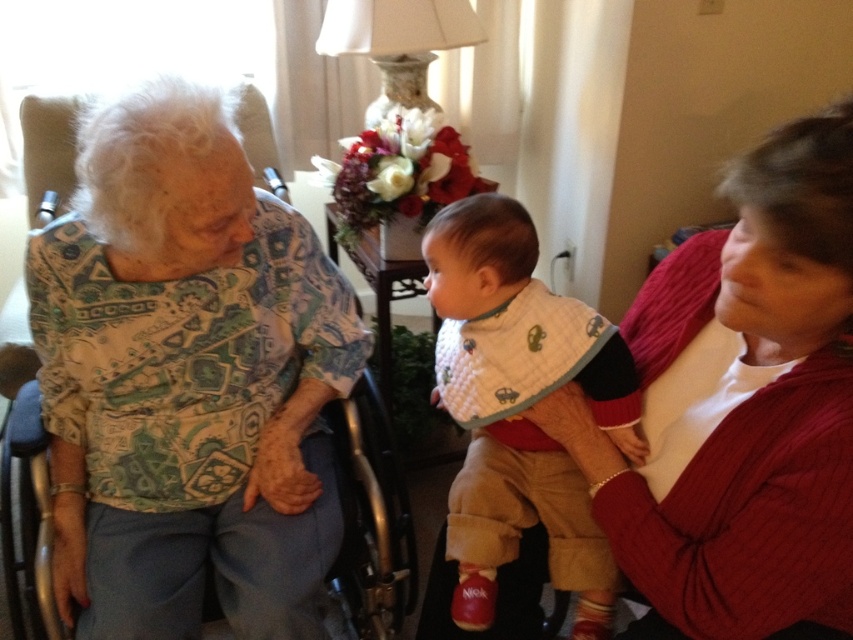
Is point (749, 596) less distant than point (28, 438)?

Yes, point (749, 596) is closer to viewer.

This screenshot has width=853, height=640. Describe the element at coordinates (741, 408) in the screenshot. I see `matte red sweater at right` at that location.

The height and width of the screenshot is (640, 853). I want to click on matte red sweater at right, so click(x=741, y=408).

Is white quilted bib at center taller than silver metallic wheelchair at left?

No, white quilted bib at center is not taller than silver metallic wheelchair at left.

Is point (482, 228) behind point (222, 300)?

No, (482, 228) is closer to viewer.

Where is `white quilted bib at center`? This screenshot has width=853, height=640. white quilted bib at center is located at coordinates (520, 406).

Looking at this image, is matte red sweater at right positioned behind white quilted bib at center?

That is False.

Find the location of a particular element. The height and width of the screenshot is (640, 853). matte red sweater at right is located at coordinates (741, 408).